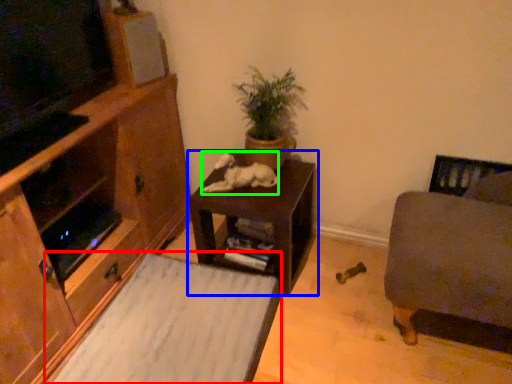
Question: Which object is positioned farthest from plain (highlighted by a red box)? Select from table (highlighted by a blue box) and animal (highlighted by a green box).

Choices:
 (A) table
 (B) animal

Answer: (B)